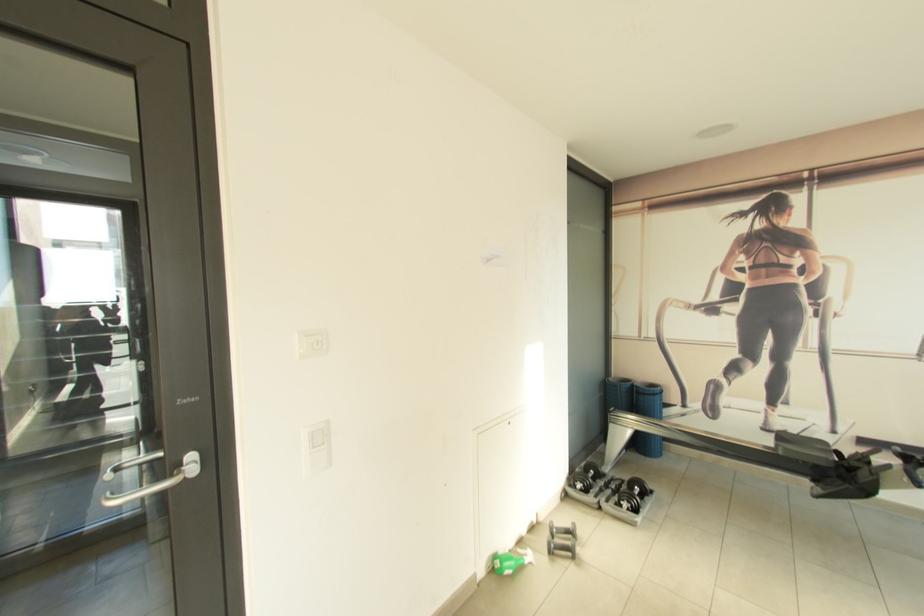
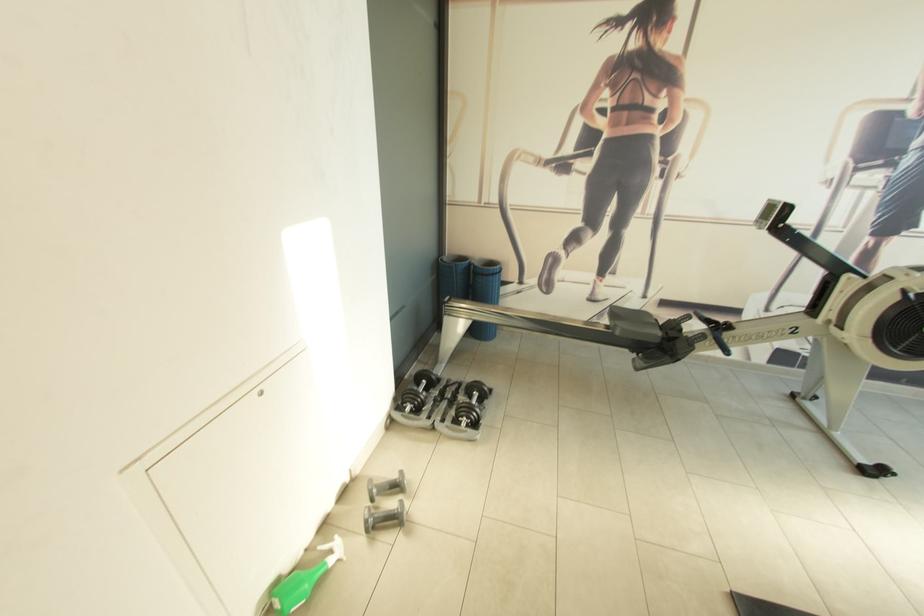
The point at (573,525) is marked in the first image. Where is the corresponding point in the second image?

(398, 477)